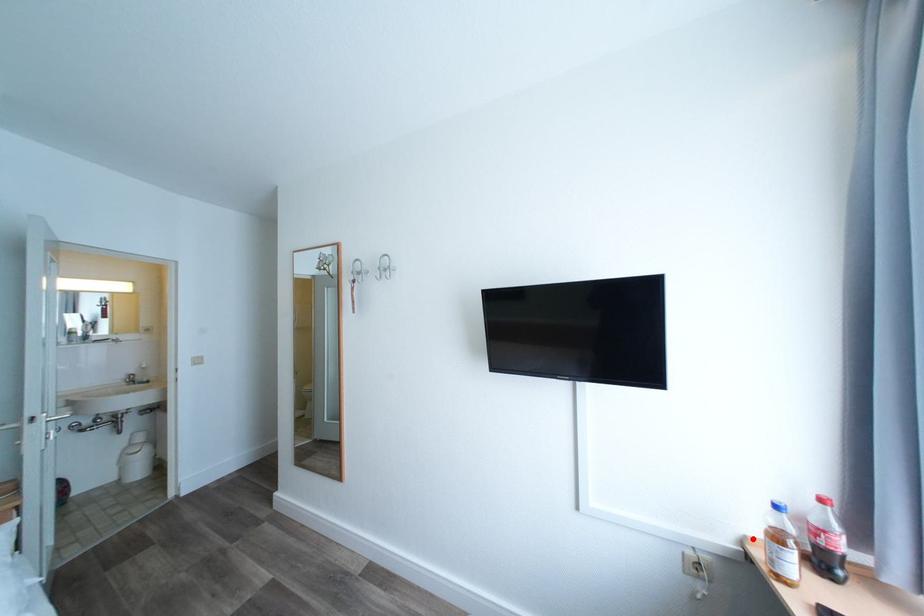
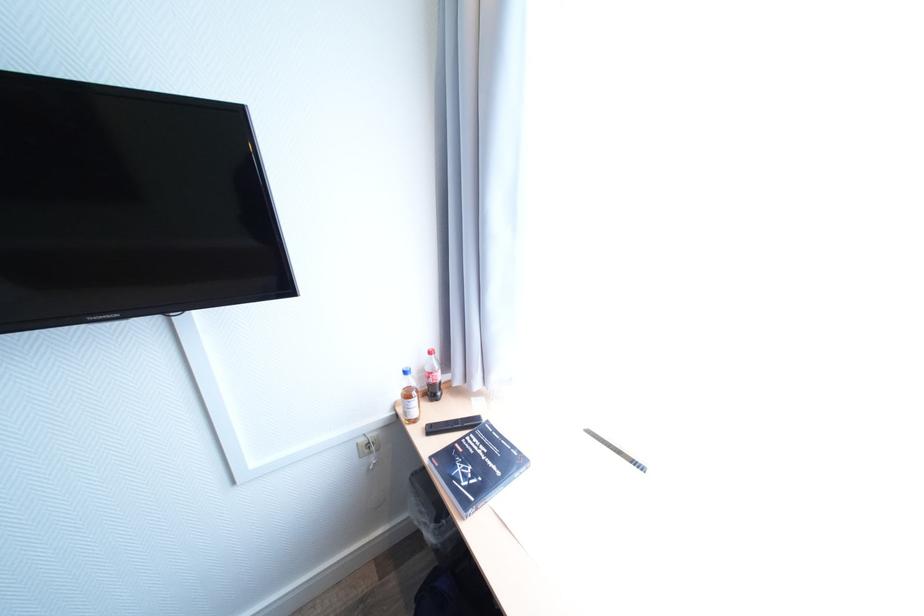
Question: A red point is marked in image1. In image2, is the corresponding 3D point closer to the camera or farther? Reply with the corresponding letter.

Choices:
 (A) The corresponding 3D point is closer.
 (B) The corresponding 3D point is farther.

Answer: (B)